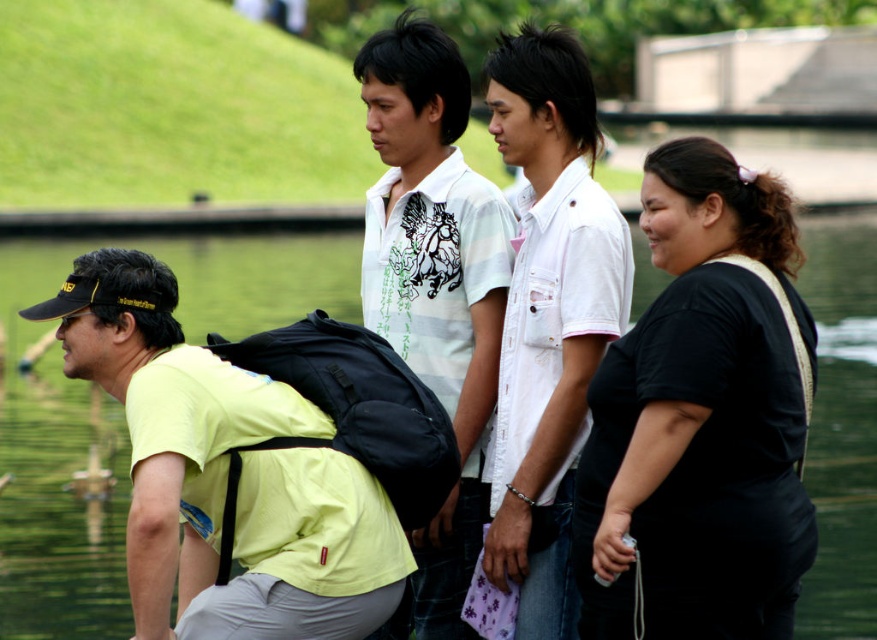
Question: Which of the following is the closest to the observer?

Choices:
 (A) (384, 310)
 (B) (161, 513)
 (C) (538, 93)
 (D) (783, 634)

Answer: (B)

Question: Where is green water at center located in relation to yellow matte shirt at left in the image?

Choices:
 (A) left
 (B) right

Answer: (B)

Question: Is yellow matte shirt at left closer to camera compared to black cotton shirt at center?

Choices:
 (A) yes
 (B) no

Answer: (A)

Question: Can you confirm if black matte shirt at right is positioned below black cotton shirt at center?

Choices:
 (A) yes
 (B) no

Answer: (A)

Question: Which object is positioned farthest from the yellow matte shirt at left?

Choices:
 (A) black matte shirt at right
 (B) white striped polo shirt at center
 (C) black cotton shirt at center

Answer: (C)

Question: Based on their relative distances, which object is nearer to the black matte shirt at right?

Choices:
 (A) black cotton shirt at center
 (B) white striped polo shirt at center
 (C) yellow matte shirt at left
 (D) green water at center

Answer: (A)